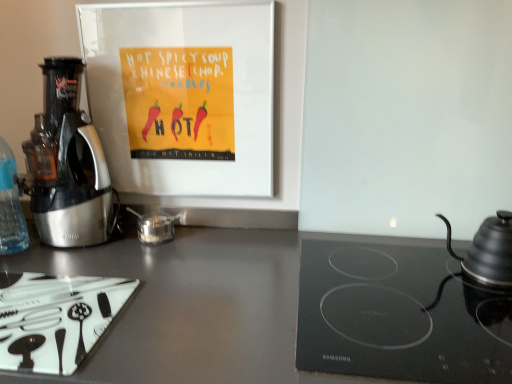
Question: Is transparent plastic bottle at left with metallic silver coffee maker at left?

Choices:
 (A) yes
 (B) no

Answer: (B)

Question: Is transparent plastic bottle at left in front of metallic silver coffee maker at left?

Choices:
 (A) yes
 (B) no

Answer: (B)

Question: From the image's perspective, is transparent plastic bottle at left above metallic silver coffee maker at left?

Choices:
 (A) no
 (B) yes

Answer: (A)

Question: Could you tell me if transparent plastic bottle at left is turned towards metallic silver coffee maker at left?

Choices:
 (A) no
 (B) yes

Answer: (A)

Question: Can you confirm if transparent plastic bottle at left is taller than metallic silver coffee maker at left?

Choices:
 (A) no
 (B) yes

Answer: (A)

Question: From a real-world perspective, relative to transparent plastic bottle at left, is metallic silver coffee maker at left vertically above or below?

Choices:
 (A) above
 (B) below

Answer: (A)

Question: Is metallic silver coffee maker at left to the left or to the right of transparent plastic bottle at left in the image?

Choices:
 (A) left
 (B) right

Answer: (B)

Question: Is metallic silver coffee maker at left bigger or smaller than transparent plastic bottle at left?

Choices:
 (A) big
 (B) small

Answer: (A)

Question: In the image, is metallic silver coffee maker at left positioned in front of or behind transparent plastic bottle at left?

Choices:
 (A) behind
 (B) front

Answer: (B)

Question: From their relative heights in the image, would you say black glass cooktop at lower right is taller or shorter than transparent glass tea pot at center?

Choices:
 (A) short
 (B) tall

Answer: (B)

Question: Is black glass cooktop at lower right wider or thinner than transparent glass tea pot at center?

Choices:
 (A) thin
 (B) wide

Answer: (B)

Question: From a real-world perspective, relative to transparent glass tea pot at center, is black glass cooktop at lower right vertically above or below?

Choices:
 (A) above
 (B) below

Answer: (B)

Question: Considering their positions, is black glass cooktop at lower right located in front of or behind transparent glass tea pot at center?

Choices:
 (A) behind
 (B) front

Answer: (B)

Question: Do you think black glass cooktop at lower right is within metallic silver coffee maker at left, or outside of it?

Choices:
 (A) outside
 (B) inside

Answer: (A)

Question: Looking at the image, does black glass cooktop at lower right seem bigger or smaller compared to metallic silver coffee maker at left?

Choices:
 (A) big
 (B) small

Answer: (B)